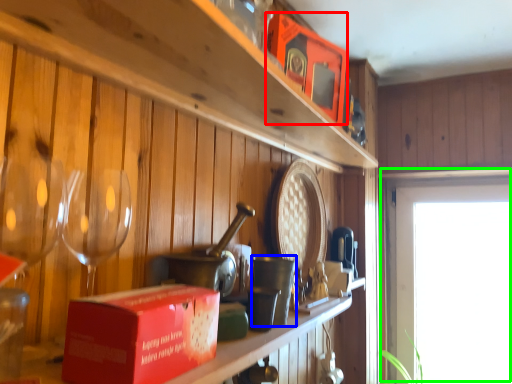
Question: Which object is the farthest from box (highlighted by a red box)? Choose among these: tableware (highlighted by a blue box) or window (highlighted by a green box).

Choices:
 (A) tableware
 (B) window

Answer: (B)